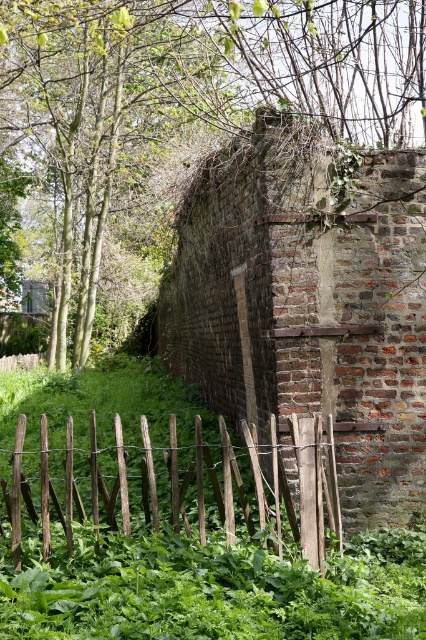
You are a gardener planning to plant flowers in the area shown in the image. Considering the brick wall at center and the green leafy grass at lower center, which area has more space available for planting?

The green leafy grass at lower center has more space available for planting since it occupies more area than the brick wall at center.

You are a gardener who wants to plant a new flower bed between the green leafy grass at lower center and the wooden fence at lower left. Which object should you start digging near to ensure the flowers will have enough space to grow?

The green leafy grass at lower center is shorter than the wooden fence at lower left, so you should start digging near the wooden fence at lower left to ensure there is enough space for the flowers to grow.

You are standing in front of the brick wall at center. What are the coordinates of its position in the image?

The brick wall at center is located at coordinates (308, 305).